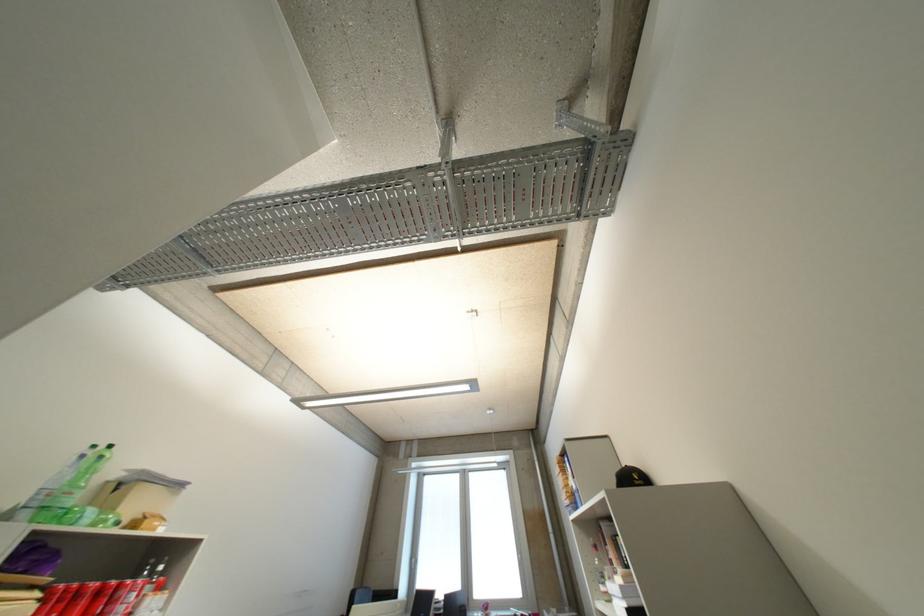
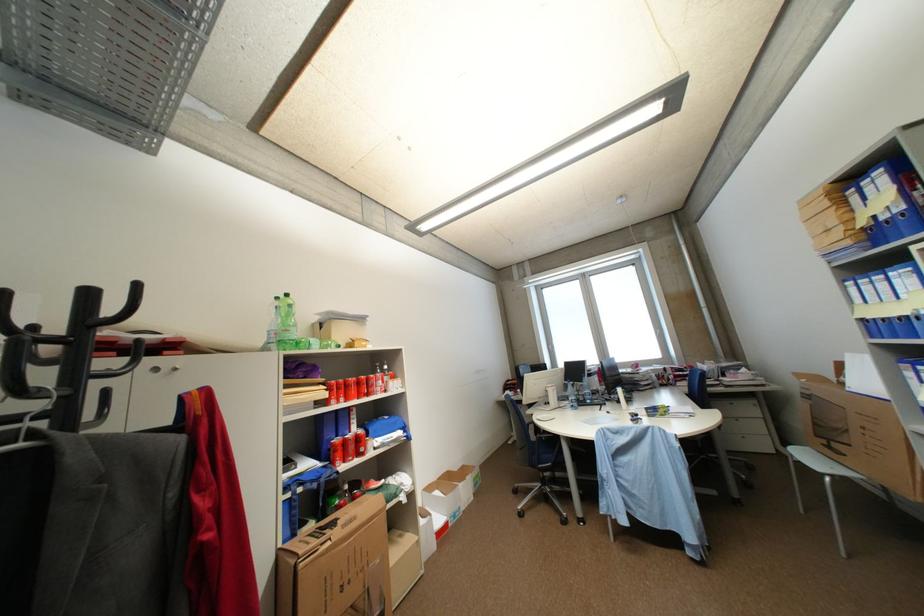
The point at (92,524) is marked in the first image. Where is the corresponding point in the second image?

(323, 349)